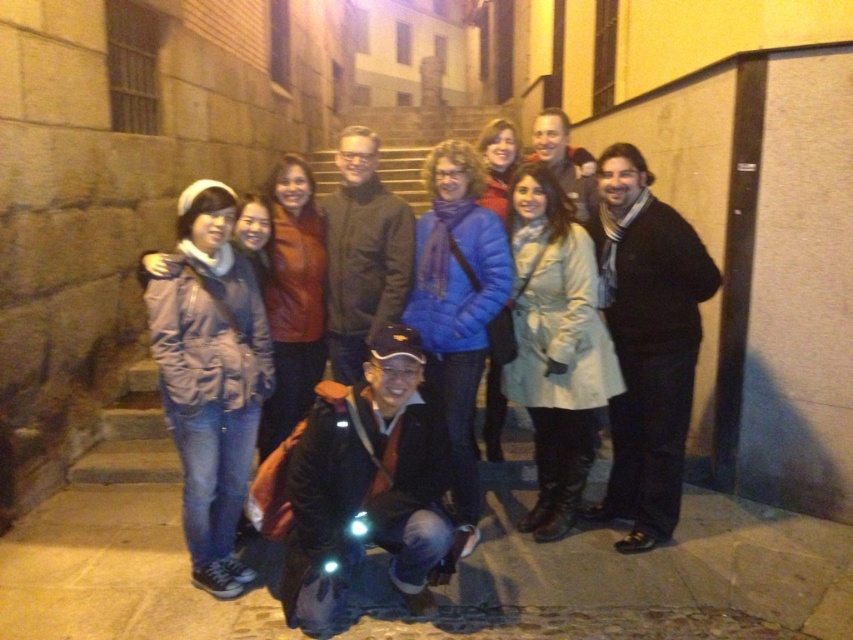
You are a photographer trying to capture a clear shot of the dark brown leather jacket at center and the black wool scarf at right. Based on their positions, which object is closer to the camera?

The black wool scarf at right is positioned under the dark brown leather jacket at center, meaning it is closer to the camera.

You are a photographer trying to decide where to place two jackets in a photo shoot. The scene has a dark brown leather jacket at center and a matte brown leather jacket at center. Which jacket should you place closer to the camera to make it appear larger in the final photo?

The dark brown leather jacket at center is smaller than the matte brown leather jacket at center. To make it appear larger in the photo, place the dark brown leather jacket at center closer to the camera.

Based on the photo, you are a photographer trying to capture a closeup shot of the dark brown leather jacket at center and the black wool scarf at right. Your camera has a maximum focus range of 3 feet. Can you focus on both objects without moving your position?

The black wool scarf at right is 3.85 feet away from the dark brown leather jacket at center. Since the distance between them is greater than 3 feet, the camera cannot focus on both objects simultaneously without moving your position.